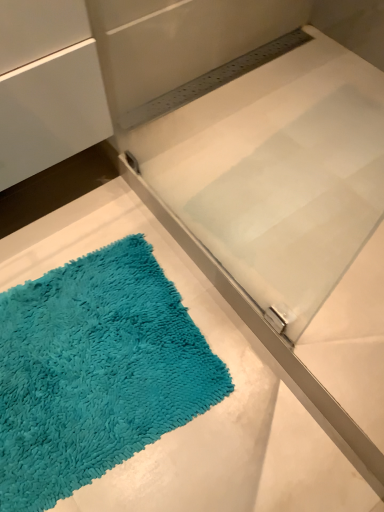
Where is `blank area beneath turquoise shaggy bath mat at lower left (from a real-world perspective)`? The image size is (384, 512). blank area beneath turquoise shaggy bath mat at lower left (from a real-world perspective) is located at coordinates (63, 396).